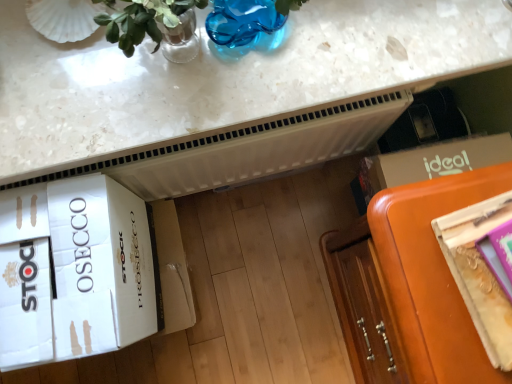
Question: Considering the positions of blue glass vase at upper center and metallic gold magazine at right in the image, is blue glass vase at upper center taller or shorter than metallic gold magazine at right?

Choices:
 (A) short
 (B) tall

Answer: (B)

Question: Considering the positions of blue glass vase at upper center and metallic gold magazine at right in the image, is blue glass vase at upper center wider or thinner than metallic gold magazine at right?

Choices:
 (A) thin
 (B) wide

Answer: (A)

Question: Considering the real-world distances, which object is closest to the blue glass vase at upper center?

Choices:
 (A) white marble countertop at upper center
 (B) metallic gold magazine at right
 (C) white cardboard box at lower left
 (D) orange leather couch at lower right

Answer: (A)

Question: Which object is positioned closest to the blue glass vase at upper center?

Choices:
 (A) orange leather couch at lower right
 (B) metallic gold magazine at right
 (C) white marble countertop at upper center
 (D) white cardboard box at lower left

Answer: (C)